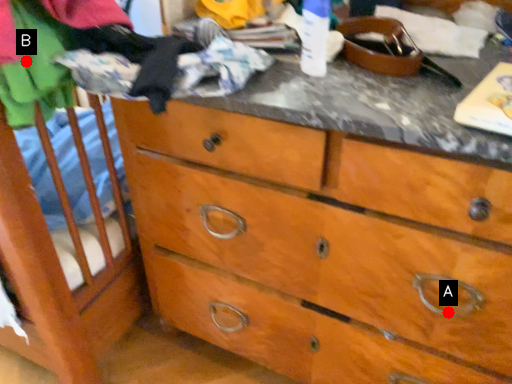
Question: Two points are circled on the image, labeled by A and B beside each circle. Which point appears closest to the camera in this image?

Choices:
 (A) A is closer
 (B) B is closer

Answer: (B)